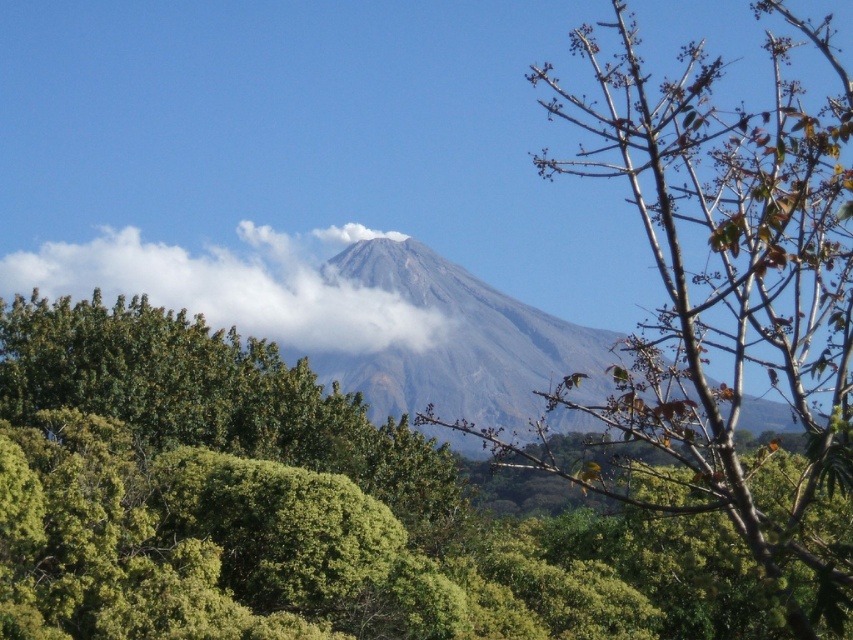
Question: Can you confirm if green leafy tree at center is positioned to the right of white fluffy cloud at upper center?

Choices:
 (A) no
 (B) yes

Answer: (B)

Question: Among these objects, which one is nearest to the camera?

Choices:
 (A) green leafy tree at center
 (B) white fluffy cloud at upper center

Answer: (A)

Question: Can you confirm if green leafy tree at center is smaller than white fluffy cloud at upper center?

Choices:
 (A) yes
 (B) no

Answer: (B)

Question: Which point is closer to the camera?

Choices:
 (A) (97, 269)
 (B) (61, 374)

Answer: (B)

Question: Does green leafy tree at center have a lesser width compared to white fluffy cloud at upper center?

Choices:
 (A) no
 (B) yes

Answer: (B)